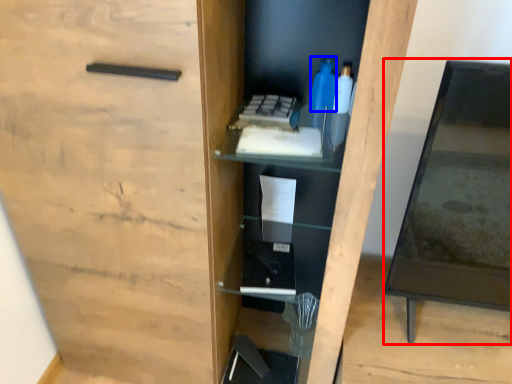
Question: Among these objects, which one is nearest to the camera, table (highlighted by a red box) or bottle (highlighted by a blue box)?

Choices:
 (A) table
 (B) bottle

Answer: (A)